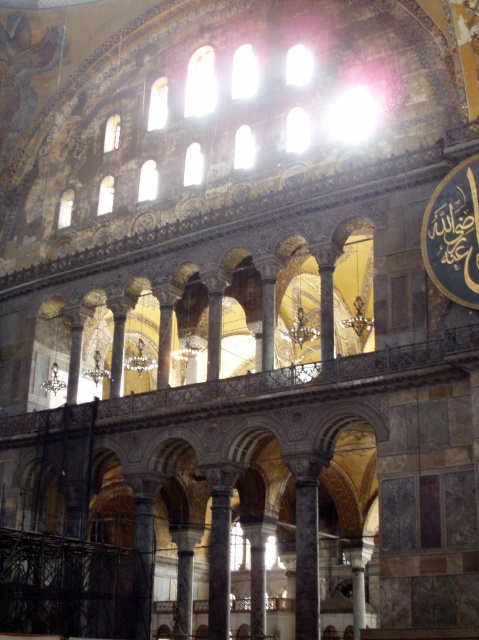
Question: Can you confirm if gold metallic clock at upper right is bigger than polished marble column at center?

Choices:
 (A) no
 (B) yes

Answer: (B)

Question: Is gold metallic clock at upper right bigger than black marble column at center?

Choices:
 (A) no
 (B) yes

Answer: (A)

Question: Is black marble column at center closer to the viewer compared to polished marble column at center?

Choices:
 (A) no
 (B) yes

Answer: (B)

Question: Which point is closer to the camera?

Choices:
 (A) black marble column at center
 (B) polished marble column at center

Answer: (A)

Question: Which of the following is the closest to the observer?

Choices:
 (A) polished marble column at center
 (B) black marble column at center
 (C) gold metallic clock at upper right

Answer: (C)

Question: Which object is the farthest from the polished marble column at center?

Choices:
 (A) gold metallic clock at upper right
 (B) black marble column at center

Answer: (A)